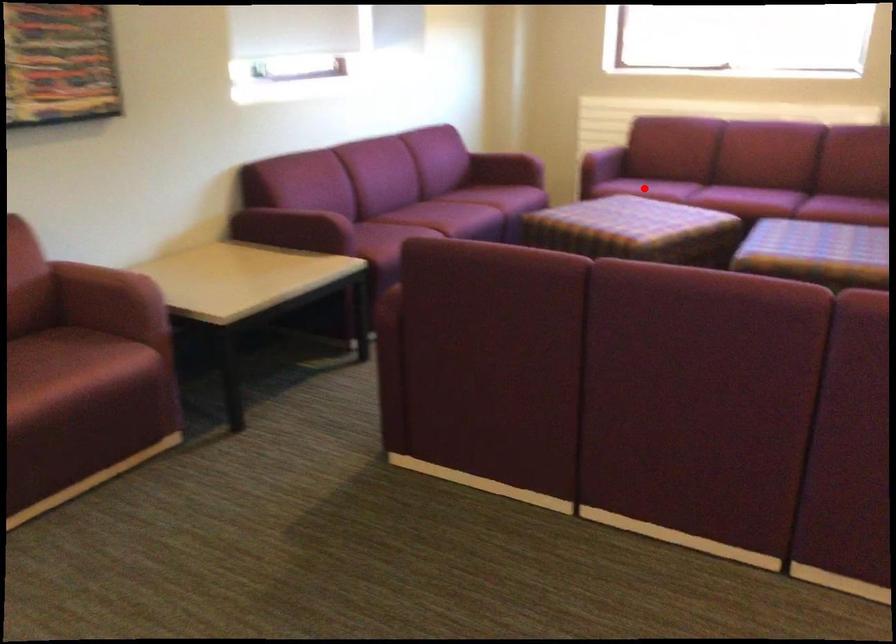
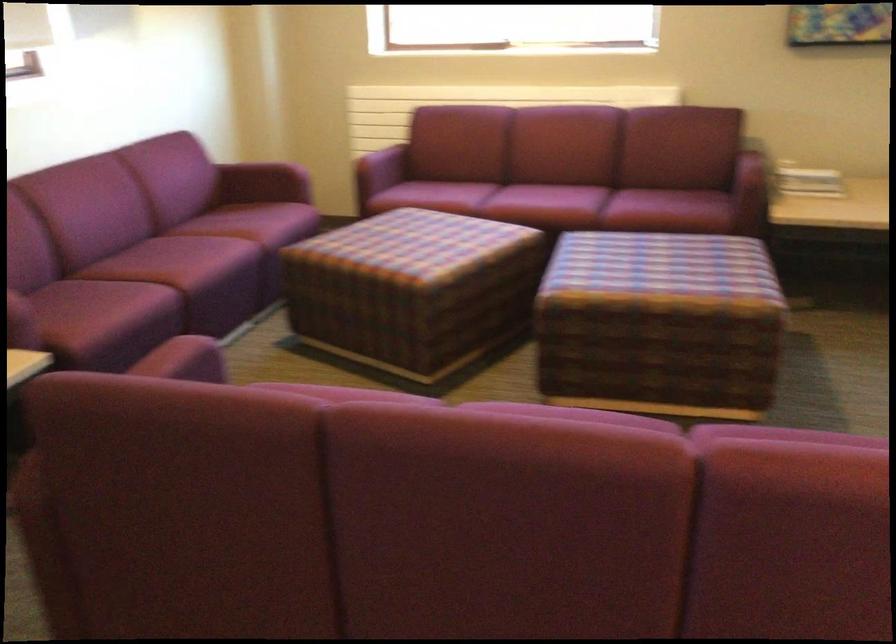
Question: I am providing you with two images of the same scene from different viewpoints. Image1 has a red point marked. In image2, the corresponding 3D location appears at what relative position? Reply with the corresponding letter.

Choices:
 (A) Closer
 (B) Farther

Answer: (A)